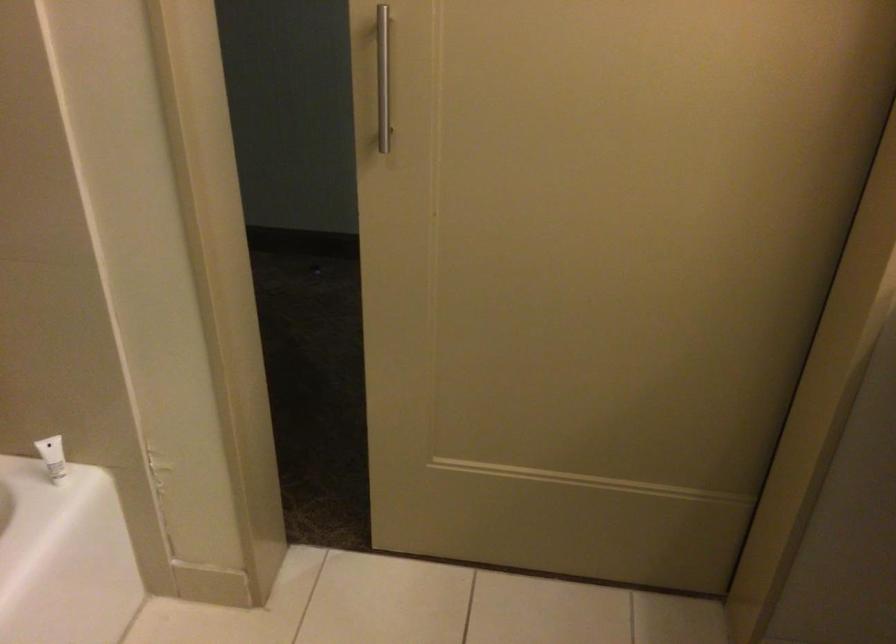
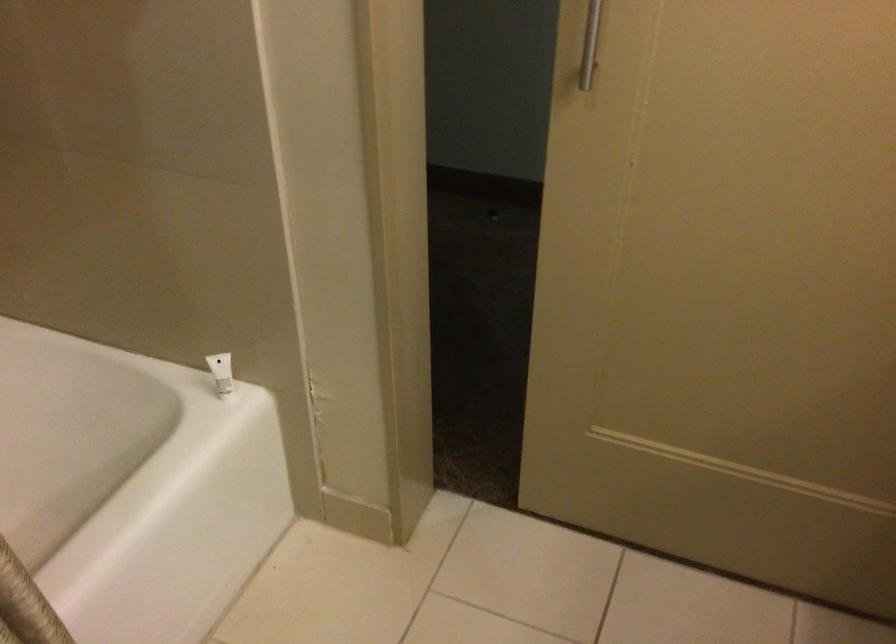
Locate, in the second image, the point that corresponds to [383,116] in the first image.

(590, 44)